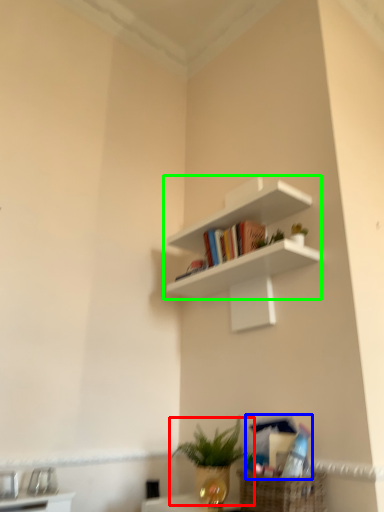
Question: Which object is positioned closest to houseplant (highlighted by a red box)? Select from book (highlighted by a blue box) and shelf (highlighted by a green box).

Choices:
 (A) book
 (B) shelf

Answer: (A)